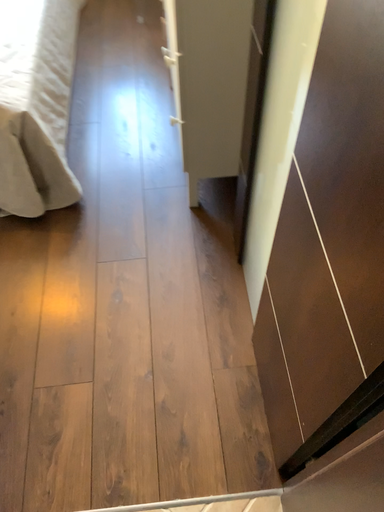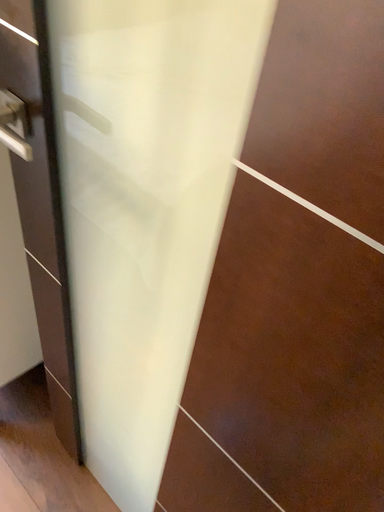
Question: Which way did the camera rotate in the video?

Choices:
 (A) rotated left
 (B) rotated right

Answer: (B)